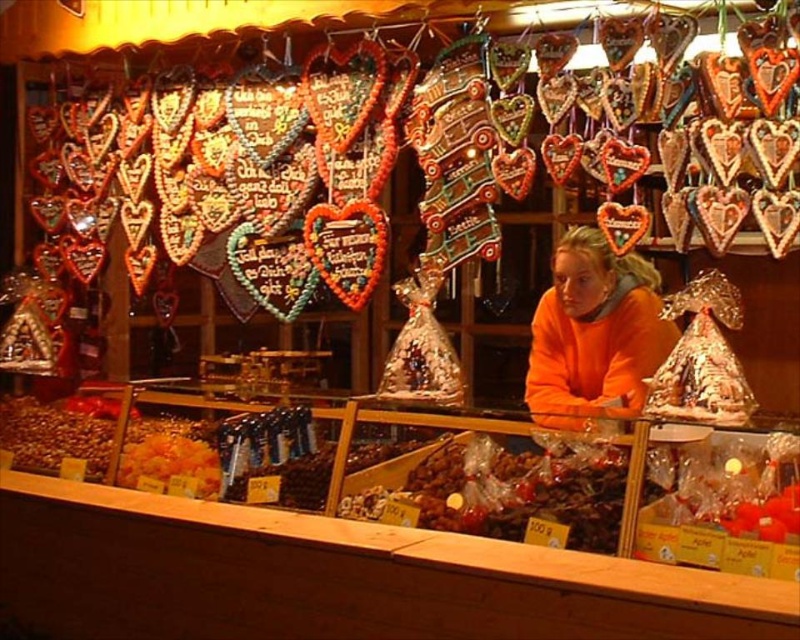
Question: Which point is closer to the camera taking this photo?

Choices:
 (A) (534, 310)
 (B) (737, 540)

Answer: (B)

Question: Which of the following is the closest to the observer?

Choices:
 (A) translucent plastic candy at center
 (B) orange fleece at center

Answer: (A)

Question: Does translucent plastic candy at center appear under orange fleece at center?

Choices:
 (A) no
 (B) yes

Answer: (B)

Question: Is translucent plastic candy at center thinner than orange fleece at center?

Choices:
 (A) yes
 (B) no

Answer: (B)

Question: Is translucent plastic candy at center bigger than orange fleece at center?

Choices:
 (A) yes
 (B) no

Answer: (A)